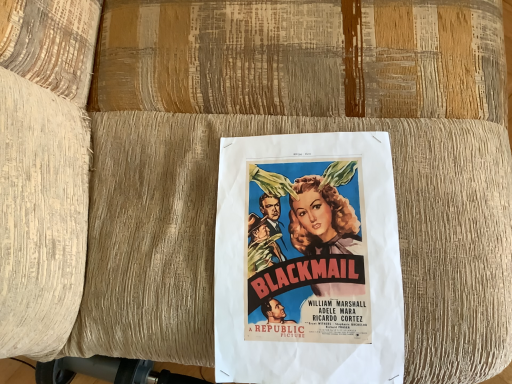
You are a GUI agent. You are given a task and a screenshot of the screen. Output one action in this format:
    pyautogui.click(x=<x>, y=<y>)
    Task: Click on the matte paper poster at center
    Image resolution: width=512 pixels, height=384 pixels.
    Given the screenshot: What is the action you would take?
    pyautogui.click(x=308, y=261)

What do you see at coordinates (308, 261) in the screenshot?
I see `matte paper poster at center` at bounding box center [308, 261].

Locate an element on the screen. The width and height of the screenshot is (512, 384). matte paper poster at center is located at coordinates (308, 261).